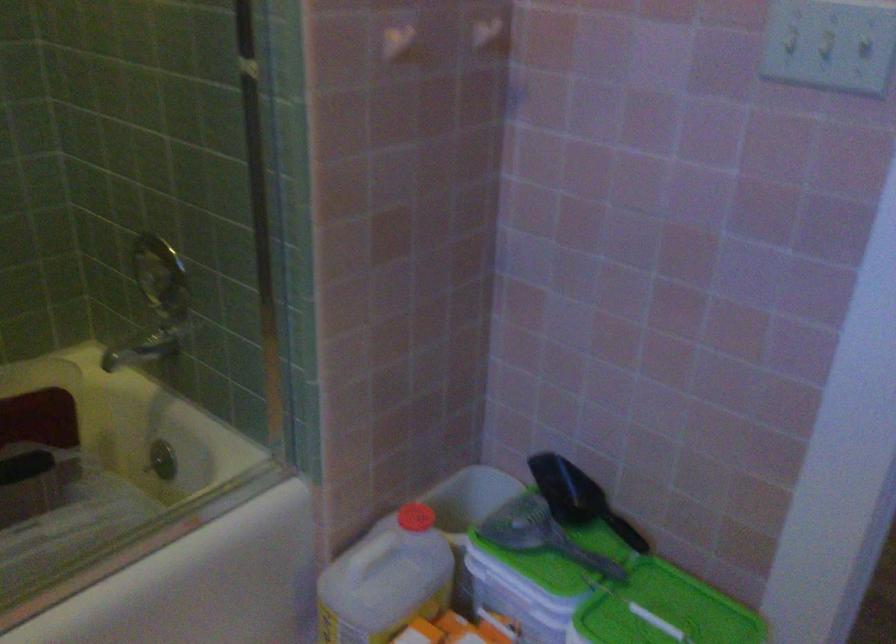
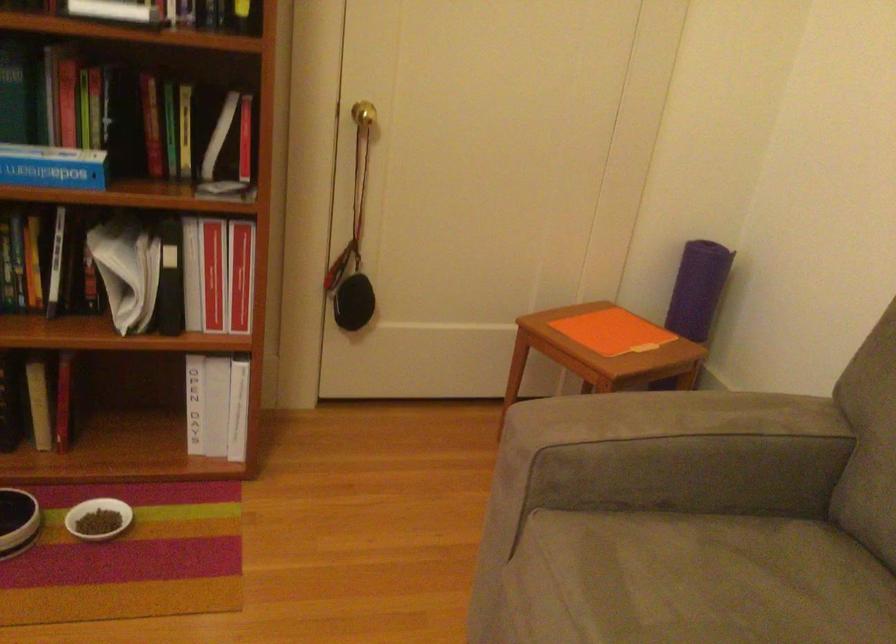
Question: I am providing you with two images of the same scene from different viewpoints. After the viewpoint changes to image2, which objects are now occluded?

Choices:
 (A) white pet bowl
 (B) sofa sitting surface
 (C) grey scoop handle
 (D) white and green plate

Answer: (C)